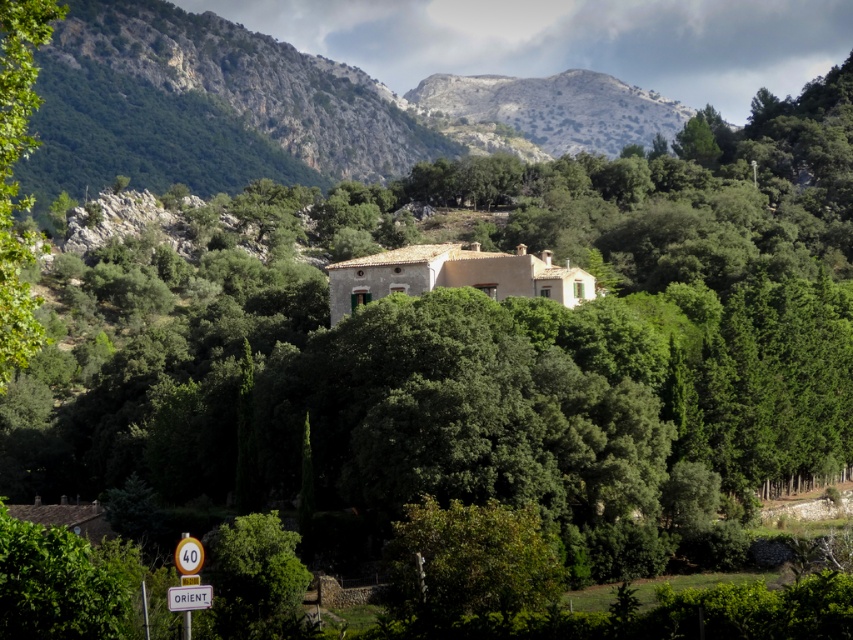
From the picture: You are a hiker standing at the edge of the forest looking towards the house. You notice the green leafy tree at lower left and the white plastic sign at center. Which object is taller?

The green leafy tree at lower left is taller than the white plastic sign at center.

You are standing at the center of the image and want to walk towards the green leafy tree at lower left. Which direction should you face to walk directly towards it?

To walk directly towards the green leafy tree at lower left, you should face towards the lower left direction since its 2D location is at point (254, 579).